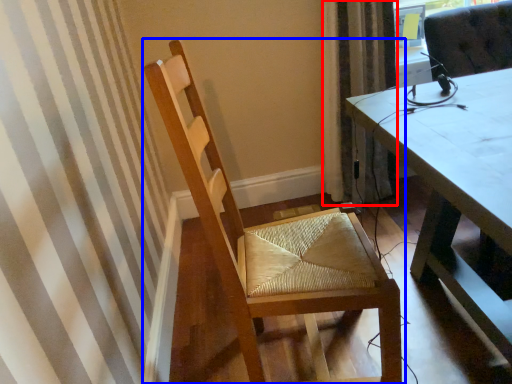
Question: Among these objects, which one is farthest to the camera, curtain (highlighted by a red box) or chair (highlighted by a blue box)?

Choices:
 (A) curtain
 (B) chair

Answer: (A)